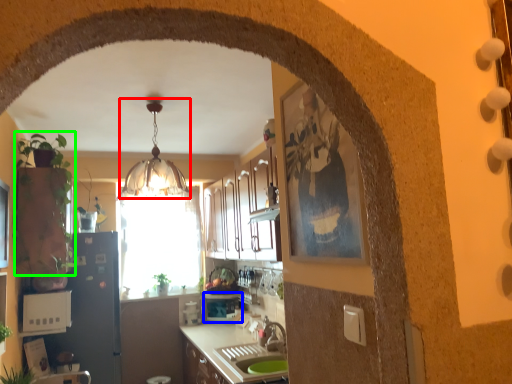
Question: Estimate the real-world distances between objects in this image. Which object is farther from light fixture (highlighted by a red box), appliance (highlighted by a blue box) or plant (highlighted by a green box)?

Choices:
 (A) appliance
 (B) plant

Answer: (A)